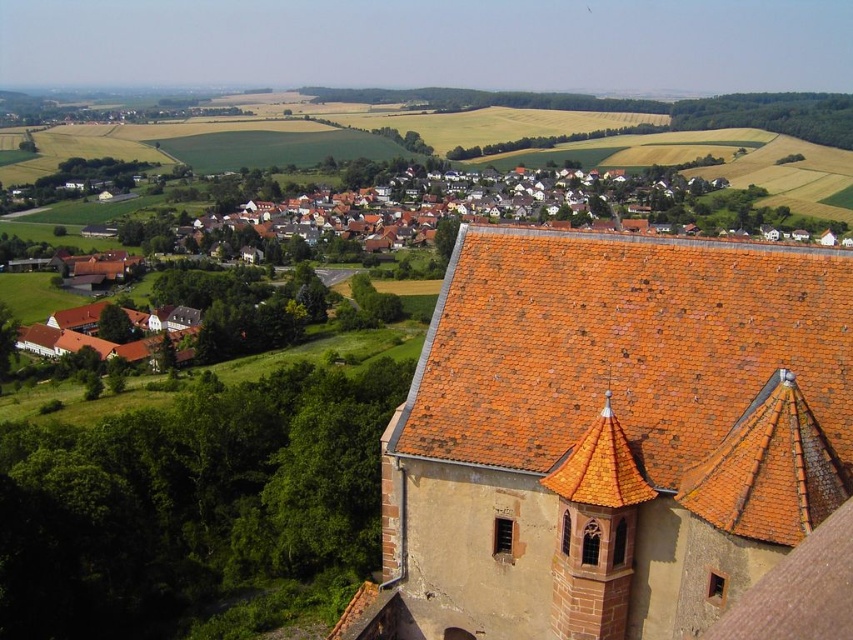
You are standing in the village and want to take a photo. There are two points of interest marked as point 1 at coordinates (723, 372) and point 2 at coordinates (647, 486). Which point is closer to you if you are facing the village?

Point 2 at coordinates (647, 486) is closer to you because it is less further to the camera than point 1 at coordinates (723, 372).

You are an architect examining the village from above. You notice the orange clay tiles at upper right and the orange tiled tower at upper right. Which object would block your view of the other when looking from this perspective?

The orange clay tiles at upper right are in front of the orange tiled tower at upper right, so they would block the view of the tower.